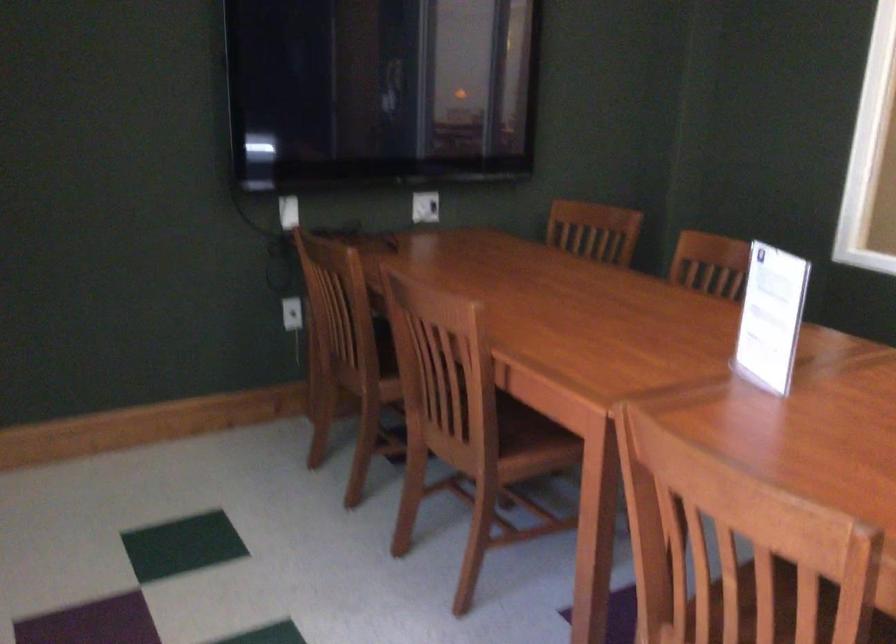
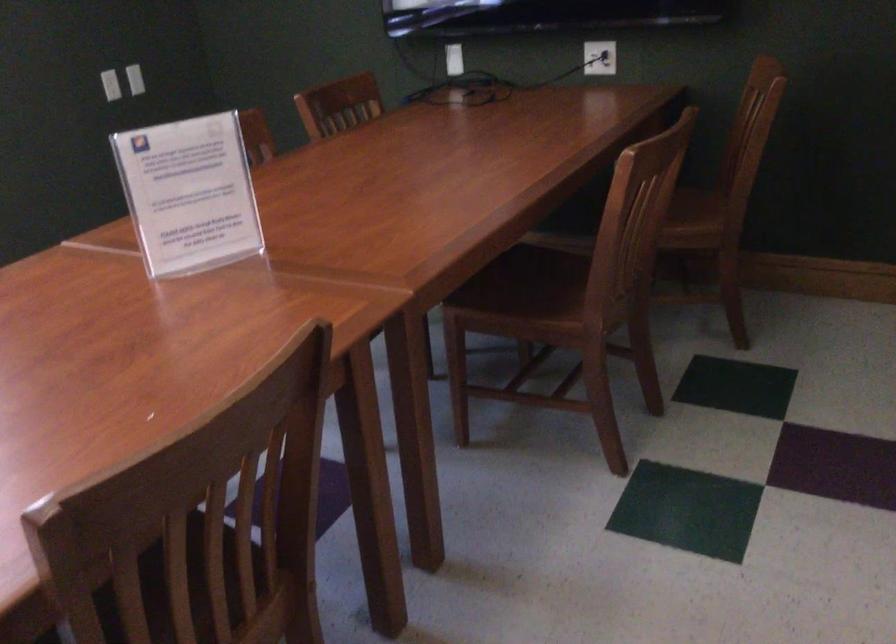
Find the pixel in the second image that matches [306,214] in the first image.

(453, 59)